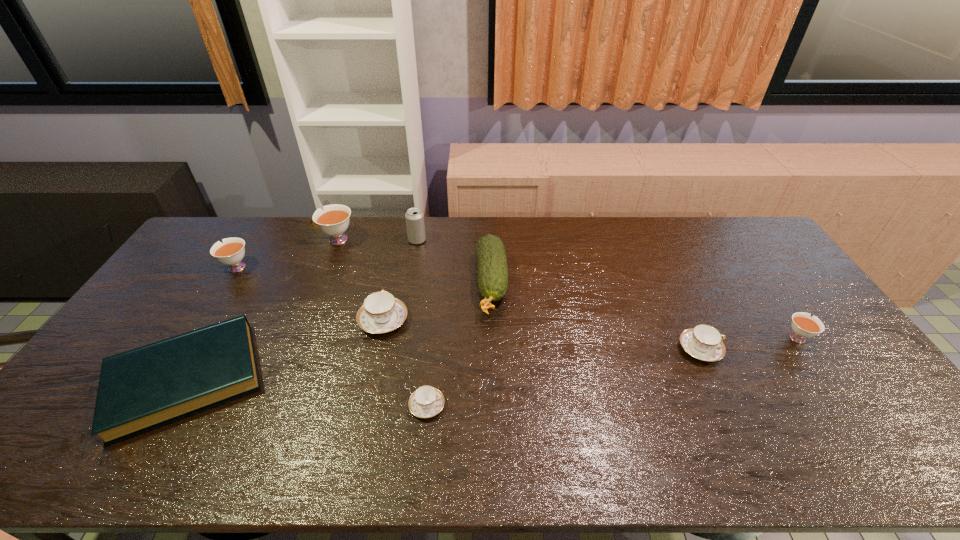
Image resolution: width=960 pixels, height=540 pixels. What are the coordinates of `free region at the right edge of the desktop` in the screenshot? It's located at (848, 379).

The image size is (960, 540). I want to click on vacant space at the near left corner, so click(x=59, y=453).

Image resolution: width=960 pixels, height=540 pixels. Find the location of `free space between the blue book and the rightmost object`. free space between the blue book and the rightmost object is located at coordinates (492, 358).

Locate an element on the screen. This screenshot has height=540, width=960. free space between the second nearest white teacup and the fourth teacup from right to left is located at coordinates (309, 294).

Find the location of a particular element. The image size is (960, 540). vacant space that is in between the second smallest white teacup and the second biggest blue teacup is located at coordinates (468, 308).

Find the location of a particular element. vacant region between the second biggest white teacup and the smallest white teacup is located at coordinates (516, 302).

Identify the location of free spot between the leftmost blue teacup and the eighth object from left to right. Image resolution: width=960 pixels, height=540 pixels. (541, 335).

The height and width of the screenshot is (540, 960). I want to click on vacant point located between the green cucumber and the farthest teacup, so click(x=414, y=261).

Where is `vacant space that is in between the leftmost white teacup and the second smallest blue teacup`? This screenshot has height=540, width=960. vacant space that is in between the leftmost white teacup and the second smallest blue teacup is located at coordinates (468, 308).

At what (x,y) coordinates should I click in order to perform the action: click on vacant area that lies between the beer can and the shortest object. Please return your answer as a coordinate pair (x, y). Image resolution: width=960 pixels, height=540 pixels. Looking at the image, I should click on (422, 323).